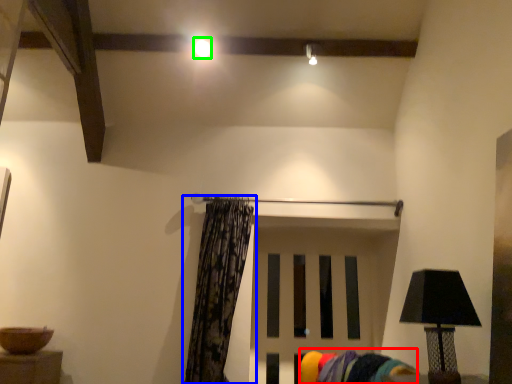
Question: Considering the real-world distances, which object is farthest from swivel chair (highlighted by a red box)? curtain (highlighted by a blue box) or lighting (highlighted by a green box)?

Choices:
 (A) curtain
 (B) lighting

Answer: (B)